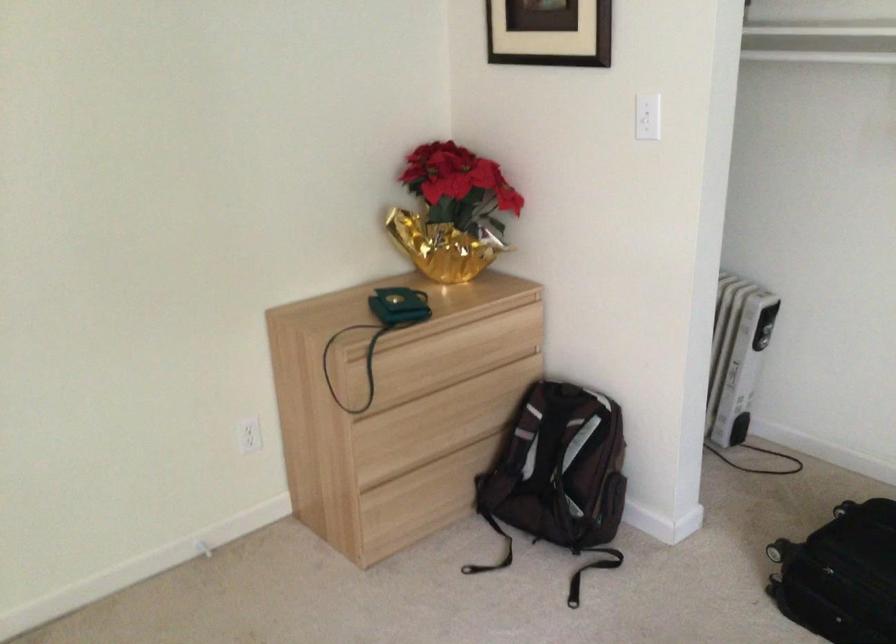
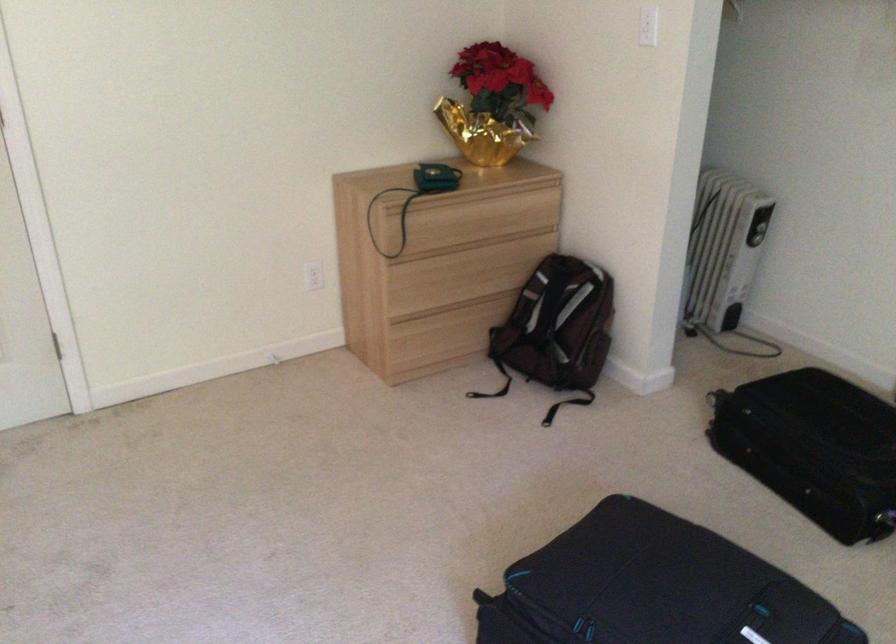
Question: I am providing you with two images of the same scene from different viewpoints. After the viewpoint changes to image2, which objects are now occluded?

Choices:
 (A) backpack top handle
 (B) white light switch
 (C) middle drawer front
 (D) none of these

Answer: (D)